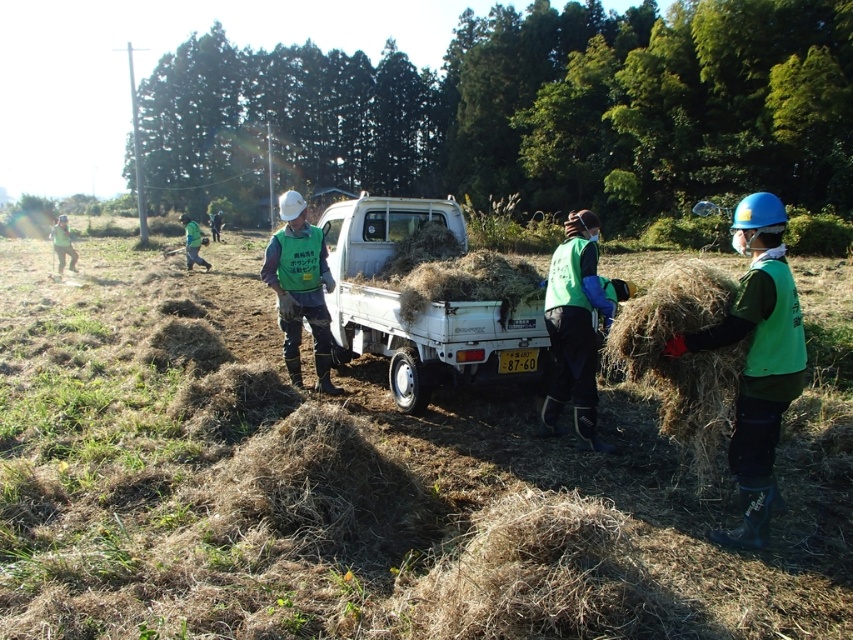
You are a worker in the field and need to determine which object is shorter between the brown dry hay at right and the green fabric vest at left. Which one is shorter?

The brown dry hay at right has a lesser height compared to the green fabric vest at left, so the brown dry hay at right is shorter.

You are a farmer who needs to move the brown dry hay at right and the green fabric vest at left to the storage shed. Which object should you move first if you want to carry the smaller item first?

The brown dry hay at right is smaller than the green fabric vest at left, so you should move the brown dry hay at right first.

You are a farmer planning to move the brown dry hay at right and the green fabric vest at left to a storage shed. Based on their sizes, which item would require more space in the truck bed during transportation?

The green fabric vest at left requires more space because it is thicker than the brown dry hay at right.